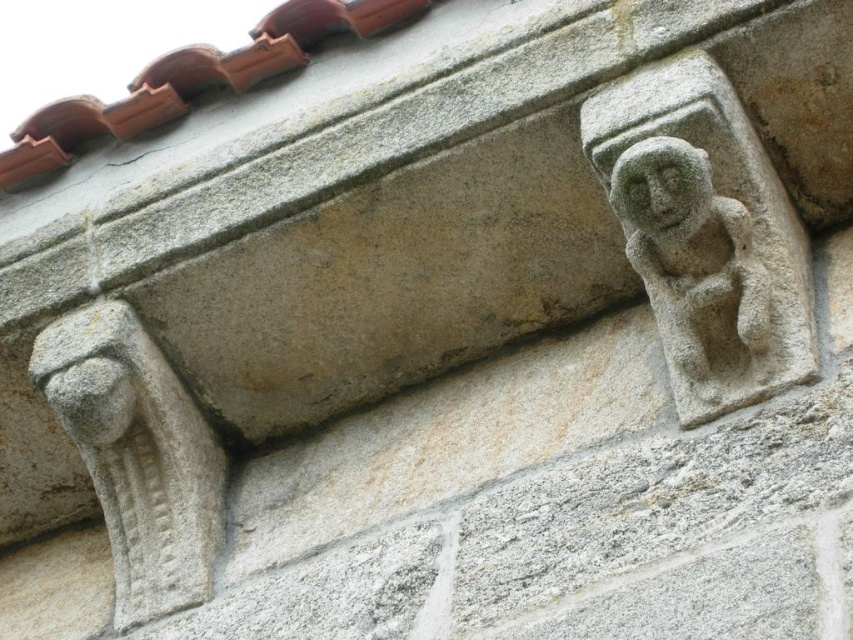
Question: Does gray stone monkey at upper right appear on the right side of green mossy stone face at upper right?

Choices:
 (A) yes
 (B) no

Answer: (A)

Question: Which object appears farthest from the camera in this image?

Choices:
 (A) green mossy stone face at upper right
 (B) gray stone monkey at upper right

Answer: (B)

Question: Can you confirm if gray stone monkey at upper right is positioned above green mossy stone face at upper right?

Choices:
 (A) yes
 (B) no

Answer: (B)

Question: Which point is closer to the camera taking this photo?

Choices:
 (A) (717, 211)
 (B) (656, 168)

Answer: (B)

Question: Which object appears closest to the camera in this image?

Choices:
 (A) green mossy stone face at upper right
 (B) gray stone monkey at upper right

Answer: (A)

Question: Does gray stone monkey at upper right appear over green mossy stone face at upper right?

Choices:
 (A) yes
 (B) no

Answer: (B)